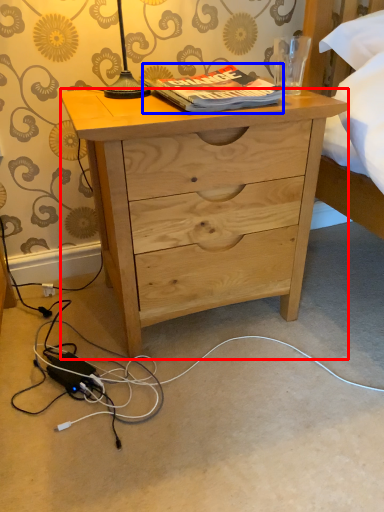
Question: Which of the following is the farthest to the observer, desk (highlighted by a red box) or book (highlighted by a blue box)?

Choices:
 (A) desk
 (B) book

Answer: (B)